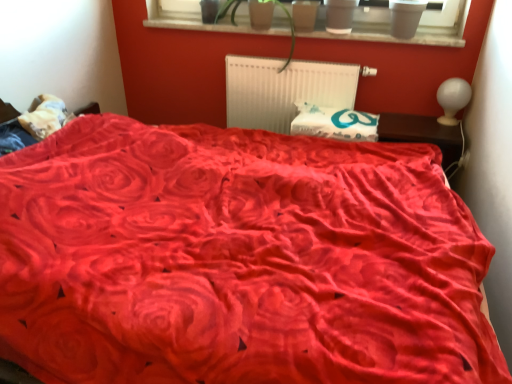
Find the location of a particular element. The width and height of the screenshot is (512, 384). blank space situated above smooth wood window sill at upper center (from a real-world perspective) is located at coordinates (287, 27).